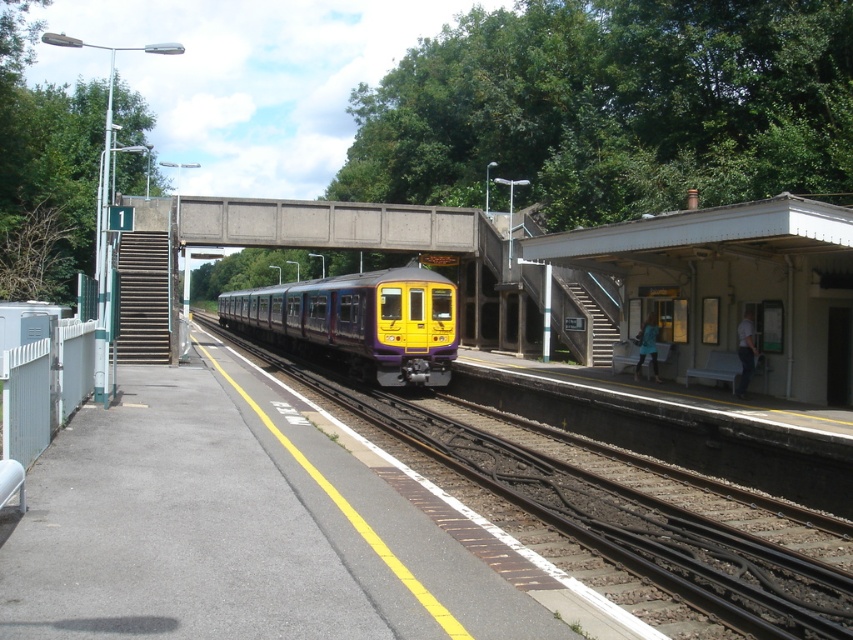
Question: Can you confirm if purple/yellow train at center is positioned to the left of concrete at center?

Choices:
 (A) no
 (B) yes

Answer: (A)

Question: Which point appears farthest from the camera in this image?

Choices:
 (A) (521, 476)
 (B) (193, 209)

Answer: (B)

Question: Among these points, which one is nearest to the camera?

Choices:
 (A) (610, 506)
 (B) (293, 349)
 (C) (492, 253)

Answer: (A)

Question: Among these points, which one is nearest to the camera?

Choices:
 (A) (582, 499)
 (B) (288, 225)

Answer: (A)

Question: Does yellow matte train at center have a larger size compared to concrete at center?

Choices:
 (A) yes
 (B) no

Answer: (A)

Question: Where is purple/yellow train at center located in relation to concrete at center in the image?

Choices:
 (A) right
 (B) left

Answer: (A)